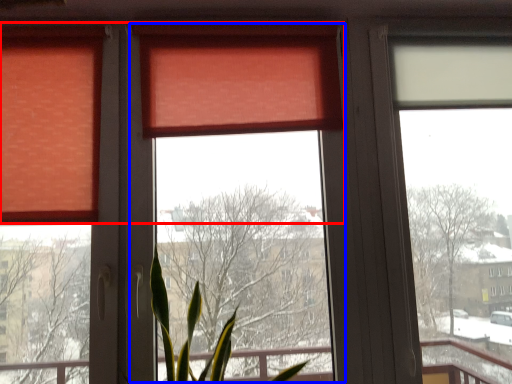
Question: Which object appears farthest to the camera in this image, curtain (highlighted by a red box) or window screen (highlighted by a blue box)?

Choices:
 (A) curtain
 (B) window screen

Answer: (A)